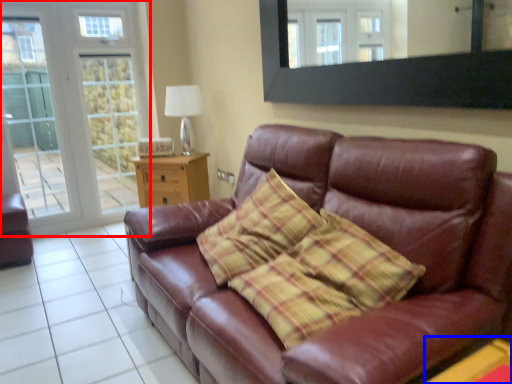
Question: Which point is closer to the camera, glass door (highlighted by a red box) or table (highlighted by a blue box)?

Choices:
 (A) glass door
 (B) table

Answer: (B)